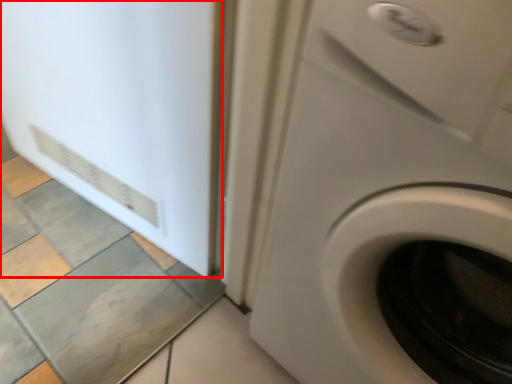
Question: From the image, what is the correct spatial relationship of screen door (annotated by the red box) in relation to washing machine?

Choices:
 (A) left
 (B) right

Answer: (A)